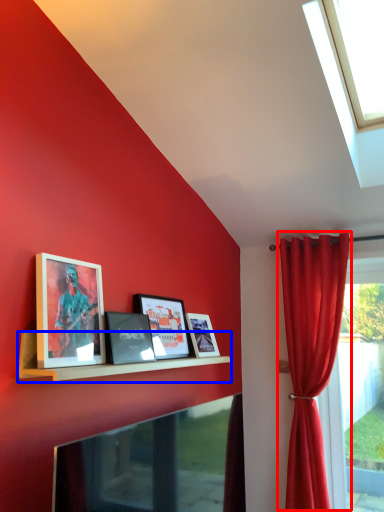
Question: Which object appears farthest to the camera in this image, curtain (highlighted by a red box) or shelf (highlighted by a blue box)?

Choices:
 (A) curtain
 (B) shelf

Answer: (A)